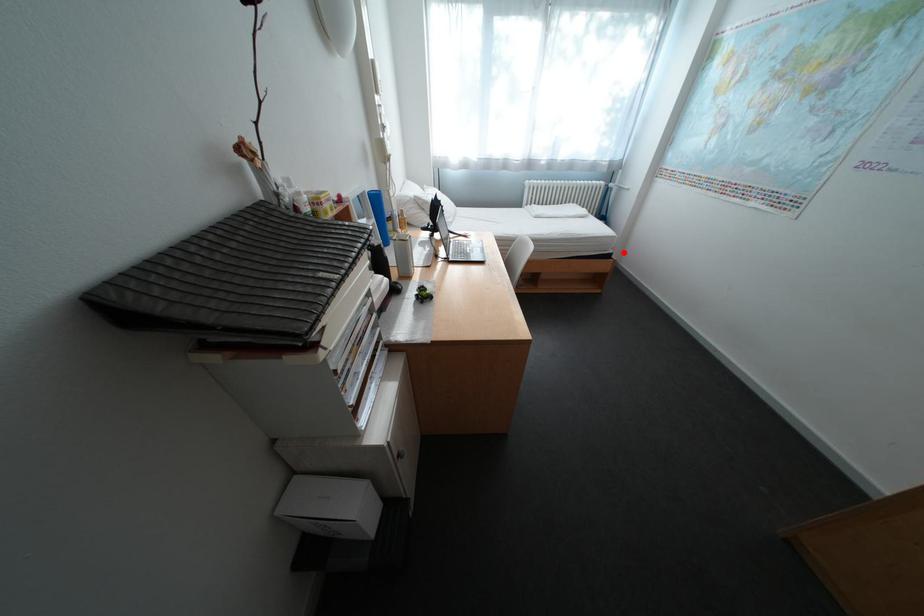
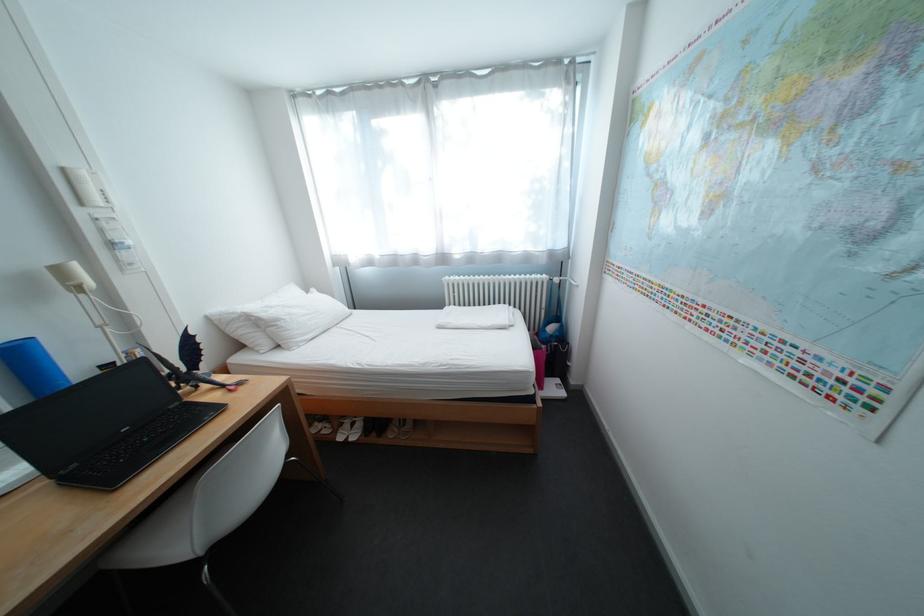
Find the pixel in the second image that matches the highlighted location in the first image.

(544, 392)